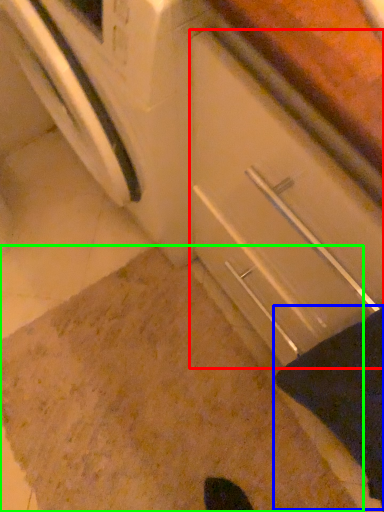
Question: Based on their relative distances, which object is nearer to drawer (highlighted by a red box)? Choose from blanket (highlighted by a blue box) and granite (highlighted by a green box).

Choices:
 (A) blanket
 (B) granite

Answer: (A)